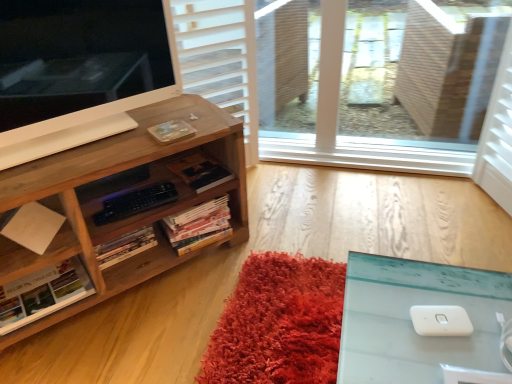
Question: From a real-world perspective, relative to white glossy computer monitor at upper left, is hardcover book at center, the fourth book positioned from the left, vertically above or below?

Choices:
 (A) below
 (B) above

Answer: (A)

Question: From the image's perspective, is hardcover book at center, the first book from the right, located above or below white glossy computer monitor at upper left?

Choices:
 (A) below
 (B) above

Answer: (A)

Question: Which of these objects is positioned farthest from the hardcover book at center, the fourth book positioned from the left?

Choices:
 (A) hardcover book at center, positioned as the 2th book in left-to-right order
 (B) wooden bookcase at left
 (C) white glossy computer monitor at upper left
 (D) white matte paper at lower left
 (E) hardcover books at center, which is the 3th book from left to right

Answer: (D)

Question: Considering the real-world distances, which object is farthest from the hardcover book at center, positioned as the 2th book in left-to-right order?

Choices:
 (A) white matte paper at lower left
 (B) white paper at left, the fourth book positioned from the right
 (C) hardcover book at center, the first book from the right
 (D) hardcover books at center, the second book from the right
 (E) white glossy computer monitor at upper left

Answer: (E)